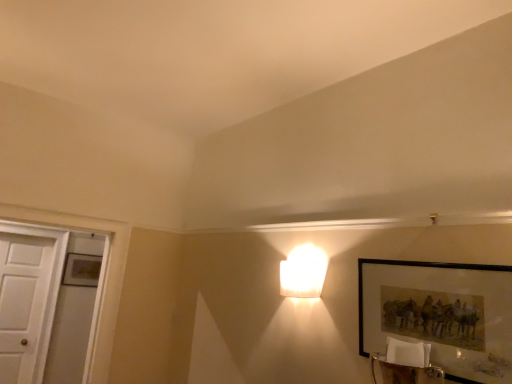
Measure the distance between point (x=7, y=378) and camera.

The depth of point (x=7, y=378) is 2.81 meters.

This screenshot has height=384, width=512. I want to click on matte black picture frame at lower right, so click(x=412, y=266).

Find the location of `white wooden door at left`. white wooden door at left is located at coordinates (22, 302).

Considering the relative sizes of white frosted glass lamp at upper center and matte black picture frame at lower right in the image provided, is white frosted glass lamp at upper center thinner than matte black picture frame at lower right?

No, white frosted glass lamp at upper center is not thinner than matte black picture frame at lower right.

Which is less distant, (301, 247) or (362, 354)?

The point (362, 354) is in front.

Considering their positions, is white frosted glass lamp at upper center located in front of or behind matte black picture frame at lower right?

Clearly, white frosted glass lamp at upper center is behind matte black picture frame at lower right.

Considering the sizes of white frosted glass lamp at upper center and matte black picture frame at lower right in the image, is white frosted glass lamp at upper center bigger or smaller than matte black picture frame at lower right?

Considering their sizes, white frosted glass lamp at upper center takes up less space than matte black picture frame at lower right.

From the image's perspective, between matte black picture frame at lower right and white wooden door at left, who is located below?

white wooden door at left.

Based on the photo, which point is more distant from viewer, [360,305] or [27,253]?

The point [27,253] is farther from the camera.

In the scene shown: Considering the relative positions of matte black picture frame at lower right and white wooden door at left in the image provided, is matte black picture frame at lower right to the left of white wooden door at left from the viewer's perspective?

In fact, matte black picture frame at lower right is to the right of white wooden door at left.

Considering the relative positions of matte black picture frame at lower right and white wooden door at left in the image provided, is matte black picture frame at lower right behind white wooden door at left?

No.

Which object is wider, white wooden door at left or white frosted glass lamp at upper center?

Wider between the two is white frosted glass lamp at upper center.

Is white wooden door at left positioned far away from white frosted glass lamp at upper center?

Yes.

From the image's perspective, is white wooden door at left on white frosted glass lamp at upper center?

No, from the image's perspective, white wooden door at left is not on top of white frosted glass lamp at upper center.

Considering the positions of objects matte black picture frame at lower right and white frosted glass lamp at upper center in the image provided, who is in front, matte black picture frame at lower right or white frosted glass lamp at upper center?

matte black picture frame at lower right is closer to the camera.

Is there a large distance between matte black picture frame at lower right and white frosted glass lamp at upper center?

No, matte black picture frame at lower right is not far from white frosted glass lamp at upper center.

The width and height of the screenshot is (512, 384). In the image, there is a white frosted glass lamp at upper center. What are the coordinates of `picture frame below it (from the image's perspective)` in the screenshot? It's located at (412, 266).

From the picture: Is matte black picture frame at lower right not inside white frosted glass lamp at upper center?

matte black picture frame at lower right is positioned outside white frosted glass lamp at upper center.

Considering the relative positions of white frosted glass lamp at upper center and white wooden door at left in the image provided, is white frosted glass lamp at upper center to the right of white wooden door at left from the viewer's perspective?

Indeed, white frosted glass lamp at upper center is positioned on the right side of white wooden door at left.

Consider the image. Can you confirm if white frosted glass lamp at upper center is bigger than white wooden door at left?

Incorrect, white frosted glass lamp at upper center is not larger than white wooden door at left.

Is white frosted glass lamp at upper center inside or outside of white wooden door at left?

white frosted glass lamp at upper center is spatially situated outside white wooden door at left.

From the image's perspective, which object appears higher, white frosted glass lamp at upper center or white wooden door at left?

From the image's view, white frosted glass lamp at upper center is above.

From a real-world perspective, relative to matte black picture frame at lower right, is white wooden door at left vertically above or below?

In terms of real-world spatial position, white wooden door at left is below matte black picture frame at lower right.

Considering the relative sizes of white wooden door at left and matte black picture frame at lower right in the image provided, is white wooden door at left shorter than matte black picture frame at lower right?

No.

Considering the sizes of white wooden door at left and matte black picture frame at lower right in the image, is white wooden door at left wider or thinner than matte black picture frame at lower right?

Clearly, white wooden door at left has more width compared to matte black picture frame at lower right.

Would you say white wooden door at left is inside or outside matte black picture frame at lower right?

white wooden door at left cannot be found inside matte black picture frame at lower right.

The width and height of the screenshot is (512, 384). Identify the location of lamp above the matte black picture frame at lower right (from a real-world perspective). (303, 272).

Identify the location of picture frame that appears on the right of white wooden door at left. This screenshot has width=512, height=384. (412, 266).

Looking at the image, which one is located further to matte black picture frame at lower right, white frosted glass lamp at upper center or white wooden door at left?

white wooden door at left is positioned further to the anchor matte black picture frame at lower right.

Looking at the image, which one is located further to white frosted glass lamp at upper center, white wooden door at left or matte black picture frame at lower right?

white wooden door at left.

Which object lies further to the anchor point white wooden door at left, white frosted glass lamp at upper center or matte black picture frame at lower right?

matte black picture frame at lower right is positioned further to the anchor white wooden door at left.

When comparing their distances from white frosted glass lamp at upper center, does matte black picture frame at lower right or white wooden door at left seem closer?

Based on the image, matte black picture frame at lower right appears to be nearer to white frosted glass lamp at upper center.

When comparing their distances from white wooden door at left, does matte black picture frame at lower right or white frosted glass lamp at upper center seem closer?

Among the two, white frosted glass lamp at upper center is located nearer to white wooden door at left.

From the image, which object appears to be nearer to matte black picture frame at lower right, white wooden door at left or white frosted glass lamp at upper center?

white frosted glass lamp at upper center.

Where is `lamp located between white wooden door at left and matte black picture frame at lower right in the left-right direction`? lamp located between white wooden door at left and matte black picture frame at lower right in the left-right direction is located at coordinates (303, 272).